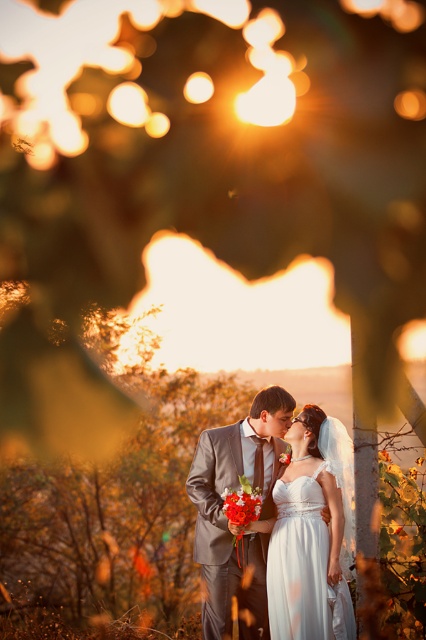
Question: Among these points, which one is farthest from the camera?

Choices:
 (A) (276, 474)
 (B) (296, 522)

Answer: (A)

Question: Can you confirm if matte gray suit at center is positioned to the left of white satin dress at center?

Choices:
 (A) no
 (B) yes

Answer: (B)

Question: Which point is closer to the camera taking this photo?

Choices:
 (A) (328, 468)
 (B) (213, 564)

Answer: (B)

Question: Does matte gray suit at center have a smaller size compared to white satin dress at center?

Choices:
 (A) yes
 (B) no

Answer: (B)

Question: Does matte gray suit at center appear on the right side of white satin dress at center?

Choices:
 (A) yes
 (B) no

Answer: (B)